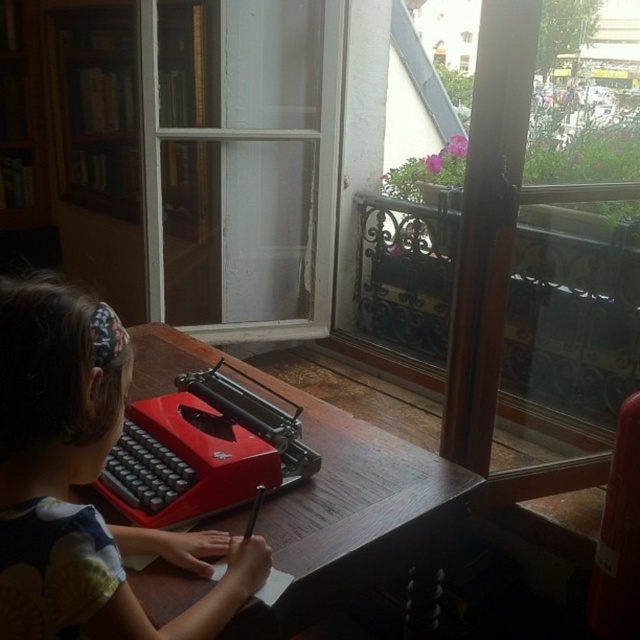
Between transparent glass door at upper center and wooden table at center, which one is positioned higher?

transparent glass door at upper center is higher up.

The image size is (640, 640). What do you see at coordinates (241, 164) in the screenshot? I see `transparent glass door at upper center` at bounding box center [241, 164].

Is point (163, 128) positioned before point (282, 548)?

No, it is not.

What are the coordinates of `transparent glass door at upper center` in the screenshot? It's located at (241, 164).

Describe the element at coordinates (241, 164) in the screenshot. I see `transparent glass door at upper center` at that location.

What do you see at coordinates (241, 164) in the screenshot?
I see `transparent glass door at upper center` at bounding box center [241, 164].

Identify the location of transparent glass door at upper center. This screenshot has height=640, width=640. (241, 164).

Does matte black hairband at upper left appear on the left side of wooden table at center?

Yes, matte black hairband at upper left is to the left of wooden table at center.

Between matte black hairband at upper left and wooden table at center, which one appears on the left side from the viewer's perspective?

From the viewer's perspective, matte black hairband at upper left appears more on the left side.

This screenshot has height=640, width=640. What do you see at coordinates (83, 481) in the screenshot? I see `matte black hairband at upper left` at bounding box center [83, 481].

Locate an element on the screen. matte black hairband at upper left is located at coordinates (83, 481).